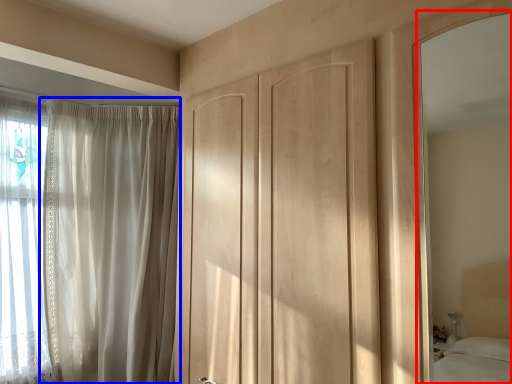
Question: Which point is closer to the camera, mirror (highlighted by a red box) or curtain (highlighted by a blue box)?

Choices:
 (A) mirror
 (B) curtain

Answer: (A)